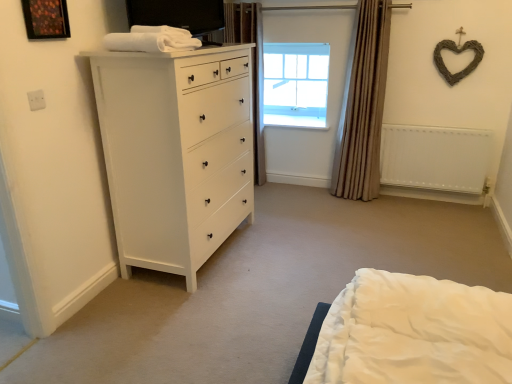
You are a GUI agent. You are given a task and a screenshot of the screen. Output one action in this format:
    pyautogui.click(x=<x>, y=<y>)
    Task: Click on the brown textured curtain at upper center, which is counted as the 1th curtain, starting from the left
    The height and width of the screenshot is (384, 512).
    Given the screenshot: What is the action you would take?
    pyautogui.click(x=253, y=68)

At what (x,y) coordinates should I click in order to perform the action: click on clear glass window at upper center. Please return your answer as a coordinate pair (x, y). The height and width of the screenshot is (384, 512). Looking at the image, I should click on (296, 84).

Locate an element on the screen. This screenshot has width=512, height=384. white matte radiator at right is located at coordinates (435, 158).

The height and width of the screenshot is (384, 512). Find the location of `white matte chest of drawers at left`. white matte chest of drawers at left is located at coordinates (175, 153).

You are a GUI agent. You are given a task and a screenshot of the screen. Output one action in this format:
    pyautogui.click(x=<x>, y=<y>)
    Task: Click on the wooden picture frame at upper left
    This screenshot has height=384, width=512.
    Given the screenshot: What is the action you would take?
    pyautogui.click(x=46, y=19)

You are a GUI agent. You are given a task and a screenshot of the screen. Output one action in this format:
    pyautogui.click(x=<x>, y=<y>)
    Task: Click on the beige fabric curtain at right, which is counted as the second curtain, starting from the left
    
    Given the screenshot: What is the action you would take?
    pyautogui.click(x=362, y=106)

Where is `brown textured curtain at upper center, which is counted as the 1th curtain, starting from the left`? Image resolution: width=512 pixels, height=384 pixels. brown textured curtain at upper center, which is counted as the 1th curtain, starting from the left is located at coordinates (253, 68).

Between wooden picture frame at upper left and beige fabric curtain at right, which is counted as the second curtain, starting from the left, which one appears on the left side from the viewer's perspective?

wooden picture frame at upper left is more to the left.

From the image's perspective, which object appears higher, wooden picture frame at upper left or beige fabric curtain at right, which is counted as the second curtain, starting from the left?

From the image's view, wooden picture frame at upper left is above.

There is a wooden picture frame at upper left. In order to click on the 2nd curtain below it (from a real-world perspective) in this screenshot , I will do `click(362, 106)`.

Is point (29, 36) behind point (338, 155)?

That is False.

From the image's perspective, is white matte radiator at right under clear glass window at upper center?

Yes, from the image's perspective, white matte radiator at right is below clear glass window at upper center.

Is white matte radiator at right aimed at clear glass window at upper center?

No.

How much distance is there between white matte radiator at right and clear glass window at upper center?

They are 1.15 meters apart.

Where is `curtain in front of the white matte radiator at right`? The width and height of the screenshot is (512, 384). curtain in front of the white matte radiator at right is located at coordinates (362, 106).

Are beige fabric curtain at right, which is counted as the second curtain, starting from the left, and white matte radiator at right located far from each other?

No, beige fabric curtain at right, which is counted as the second curtain, starting from the left, is not far away from white matte radiator at right.

Which is behind, beige fabric curtain at right, which is counted as the second curtain, starting from the left, or white matte radiator at right?

white matte radiator at right.

Which point is more forward, (367, 35) or (409, 152)?

Positioned in front is point (367, 35).

How far apart are white soft towel at upper left and clear glass window at upper center?

A distance of 7.18 feet exists between white soft towel at upper left and clear glass window at upper center.

Could you tell me if white soft towel at upper left is facing clear glass window at upper center?

No, white soft towel at upper left is not aimed at clear glass window at upper center.

From the image's perspective, which one is positioned higher, white soft towel at upper left or clear glass window at upper center?

clear glass window at upper center is shown above in the image.

Does white soft towel at upper left have a smaller size compared to clear glass window at upper center?

Indeed, white soft towel at upper left has a smaller size compared to clear glass window at upper center.

Could you tell me if white soft towel at upper left is facing white matte radiator at right?

No, white soft towel at upper left is not oriented towards white matte radiator at right.

How far apart are white soft towel at upper left and white matte radiator at right?

white soft towel at upper left is 2.24 meters from white matte radiator at right.

Would you say white soft towel at upper left is inside or outside white matte radiator at right?

white soft towel at upper left is located beyond the bounds of white matte radiator at right.

From the image's perspective, is white soft towel at upper left beneath white matte radiator at right?

No, from the image's perspective, white soft towel at upper left is not beneath white matte radiator at right.

From the picture: Considering the positions of objects white matte chest of drawers at left and white matte radiator at right in the image provided, who is more to the right, white matte chest of drawers at left or white matte radiator at right?

From the viewer's perspective, white matte radiator at right appears more on the right side.

Is white matte chest of drawers at left looking in the opposite direction of white matte radiator at right?

No, white matte chest of drawers at left's orientation is not away from white matte radiator at right.

At what (x,y) coordinates should I click in order to perform the action: click on the chest of drawers above the white matte radiator at right (from a real-world perspective). Please return your answer as a coordinate pair (x, y). Looking at the image, I should click on (175, 153).

Looking at this image, from the image's perspective, is wooden picture frame at upper left beneath white matte chest of drawers at left?

Actually, wooden picture frame at upper left appears above white matte chest of drawers at left in the image.

Between wooden picture frame at upper left and white matte chest of drawers at left, which one has smaller size?

Smaller between the two is wooden picture frame at upper left.

In terms of width, does wooden picture frame at upper left look wider or thinner when compared to white matte chest of drawers at left?

Considering their sizes, wooden picture frame at upper left looks slimmer than white matte chest of drawers at left.

Considering the sizes of wooden picture frame at upper left and white matte chest of drawers at left in the image, is wooden picture frame at upper left taller or shorter than white matte chest of drawers at left?

wooden picture frame at upper left is shorter than white matte chest of drawers at left.

Identify the location of the 2nd curtain positioned below the wooden picture frame at upper left (from a real-world perspective). (362, 106).

Where is `radiator in front of the clear glass window at upper center`? Image resolution: width=512 pixels, height=384 pixels. radiator in front of the clear glass window at upper center is located at coordinates (435, 158).

When comparing their distances from wooden picture frame at upper left, does white matte radiator at right or clear glass window at upper center seem closer?

Based on the image, clear glass window at upper center appears to be nearer to wooden picture frame at upper left.

Based on their spatial positions, is white soft towel at upper left or brown textured curtain at upper center, acting as the second curtain starting from the right, closer to beige fabric curtain at right, the 1th curtain viewed from the right?

brown textured curtain at upper center, acting as the second curtain starting from the right, is positioned closer to the anchor beige fabric curtain at right, the 1th curtain viewed from the right.

Based on their spatial positions, is white matte chest of drawers at left or wooden picture frame at upper left further from white matte radiator at right?

Among the two, wooden picture frame at upper left is located further to white matte radiator at right.

Which object lies further to the anchor point white matte radiator at right, clear glass window at upper center or wooden picture frame at upper left?

wooden picture frame at upper left lies further to white matte radiator at right than the other object.

Based on their spatial positions, is white matte chest of drawers at left or brown textured curtain at upper center, which is counted as the 1th curtain, starting from the left, further from white matte radiator at right?

white matte chest of drawers at left.

Which object lies nearer to the anchor point white matte chest of drawers at left, brown textured curtain at upper center, acting as the second curtain starting from the right, or clear glass window at upper center?

brown textured curtain at upper center, acting as the second curtain starting from the right.

Looking at the image, which one is located further to wooden picture frame at upper left, beige fabric curtain at right, the 1th curtain viewed from the right, or white soft towel at upper left?

Among the two, beige fabric curtain at right, the 1th curtain viewed from the right, is located further to wooden picture frame at upper left.

Estimate the real-world distances between objects in this image. Which object is further from clear glass window at upper center, white soft towel at upper left or beige fabric curtain at right, the 1th curtain viewed from the right?

white soft towel at upper left is further to clear glass window at upper center.

The image size is (512, 384). What are the coordinates of `chest of drawers between wooden picture frame at upper left and white matte radiator at right in the horizontal direction` in the screenshot? It's located at 175,153.

Identify the location of blanket between wooden picture frame at upper left and brown textured curtain at upper center, which is counted as the 1th curtain, starting from the left, in the front-back direction. (152, 40).

Find the location of a particular element. The image size is (512, 384). window situated between wooden picture frame at upper left and white matte radiator at right from left to right is located at coordinates (296, 84).

Where is `curtain between wooden picture frame at upper left and brown textured curtain at upper center, acting as the second curtain starting from the right, in the front-back direction`? The height and width of the screenshot is (384, 512). curtain between wooden picture frame at upper left and brown textured curtain at upper center, acting as the second curtain starting from the right, in the front-back direction is located at coordinates [x=362, y=106].